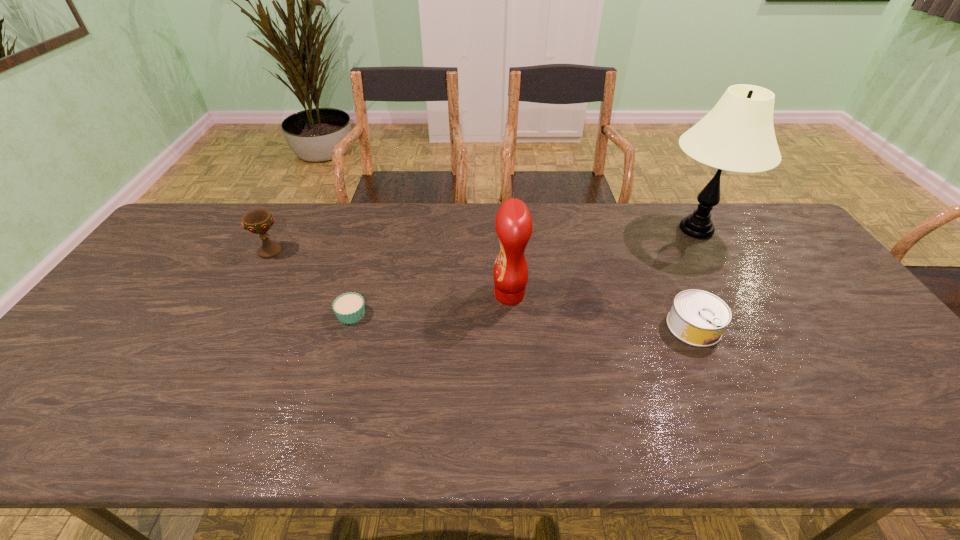
Where is `lamp`? The height and width of the screenshot is (540, 960). lamp is located at coordinates (738, 135).

Where is `the fourth shortest object`? the fourth shortest object is located at coordinates (514, 224).

The height and width of the screenshot is (540, 960). In order to click on the third object from left to right in this screenshot , I will do `click(514, 224)`.

At what (x,y) coordinates should I click in order to perform the action: click on the leftmost object. Please return your answer as a coordinate pair (x, y). The image size is (960, 540). Looking at the image, I should click on (259, 221).

You are a GUI agent. You are given a task and a screenshot of the screen. Output one action in this format:
    pyautogui.click(x=<x>, y=<y>)
    Task: Click on the chalice
    The width and height of the screenshot is (960, 540).
    Given the screenshot: What is the action you would take?
    pyautogui.click(x=259, y=221)

Identify the location of the second shortest object. (698, 318).

Image resolution: width=960 pixels, height=540 pixels. In order to click on the fourth object from right to left in this screenshot , I will do `click(349, 308)`.

The image size is (960, 540). Identify the location of cupcake. (349, 308).

This screenshot has width=960, height=540. What are the coordinates of `free spot located on the front of the tallest object` in the screenshot? It's located at (739, 303).

Find the location of `free spot located 0.090m on the label side of the condiment`. free spot located 0.090m on the label side of the condiment is located at coordinates (461, 295).